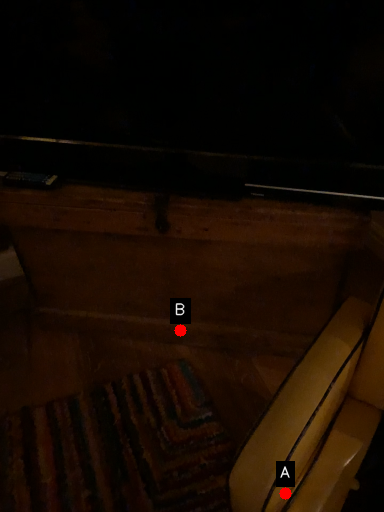
Question: Two points are circled on the image, labeled by A and B beside each circle. Among these points, which one is nearest to the camera?

Choices:
 (A) A is closer
 (B) B is closer

Answer: (A)